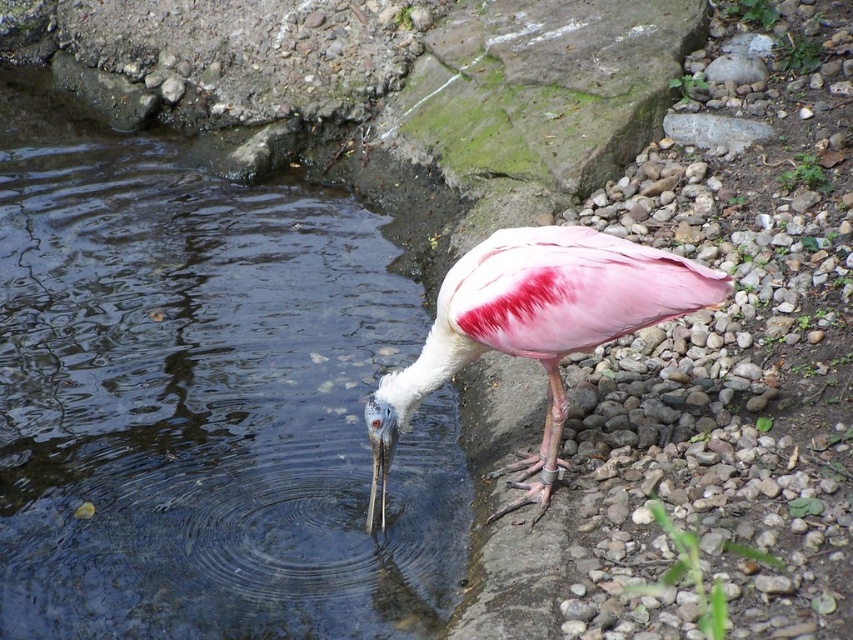
Question: Which point is farther to the camera?

Choices:
 (A) (505, 230)
 (B) (369, 310)

Answer: (B)

Question: Which point appears closest to the camera in this image?

Choices:
 (A) (x=254, y=252)
 (B) (x=424, y=388)

Answer: (B)

Question: Is clear water at center wider than pink feathered bird at center?

Choices:
 (A) yes
 (B) no

Answer: (A)

Question: Is clear water at center positioned in front of pink feathered bird at center?

Choices:
 (A) no
 (B) yes

Answer: (A)

Question: Which point appears closest to the camera in this image?

Choices:
 (A) (320, 198)
 (B) (618, 252)

Answer: (B)

Question: Does clear water at center appear on the left side of pink feathered bird at center?

Choices:
 (A) yes
 (B) no

Answer: (A)